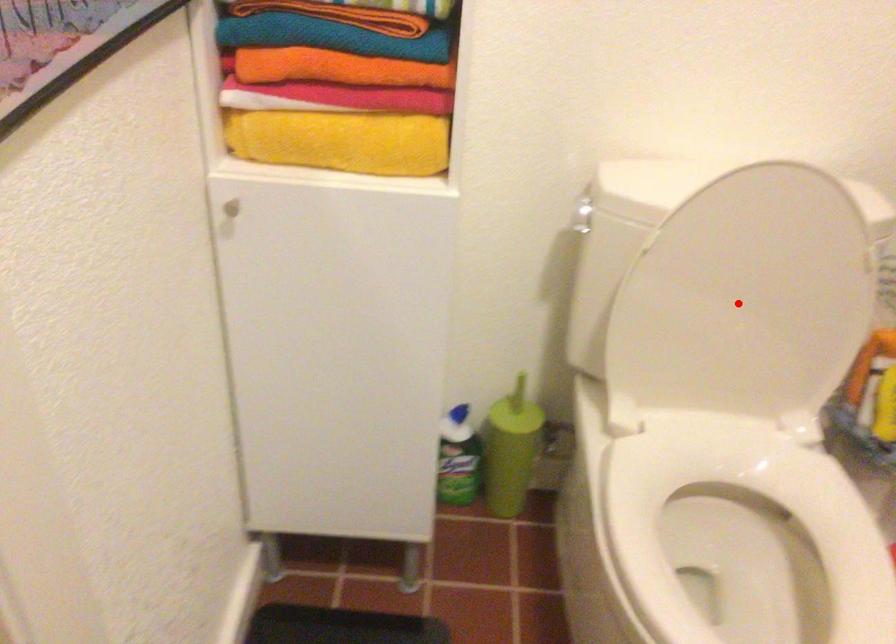
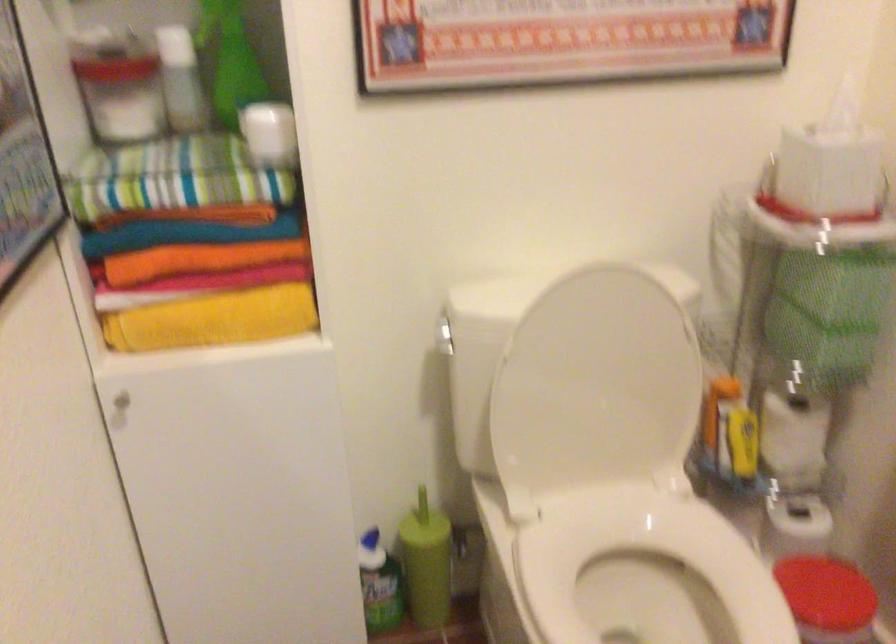
Question: I am providing you with two images of the same scene from different viewpoints. Image1 has a red point marked. In image2, the corresponding 3D location appears at what relative position? Reply with the corresponding letter.

Choices:
 (A) Closer
 (B) Farther

Answer: (B)